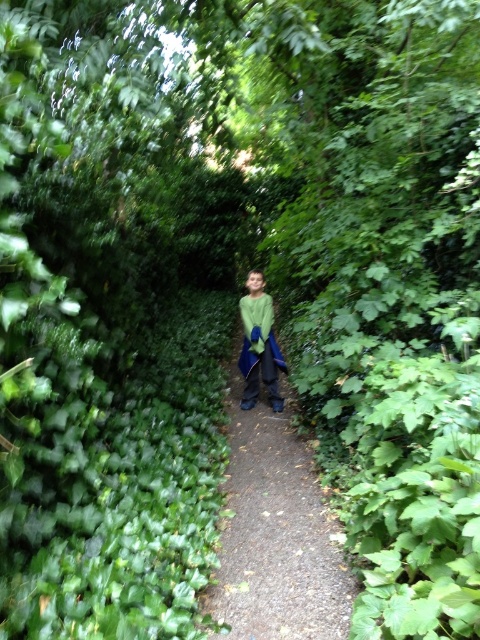
Question: Does smooth dirt path at center appear on the right side of green matte jacket at center?

Choices:
 (A) no
 (B) yes

Answer: (B)

Question: Among these objects, which one is nearest to the camera?

Choices:
 (A) green matte jacket at center
 (B) smooth dirt path at center

Answer: (B)

Question: Can you confirm if smooth dirt path at center is bigger than green matte jacket at center?

Choices:
 (A) no
 (B) yes

Answer: (B)

Question: Which point appears farthest from the camera in this image?

Choices:
 (A) (256, 339)
 (B) (298, 540)

Answer: (A)

Question: Does smooth dirt path at center come in front of green matte jacket at center?

Choices:
 (A) yes
 (B) no

Answer: (A)